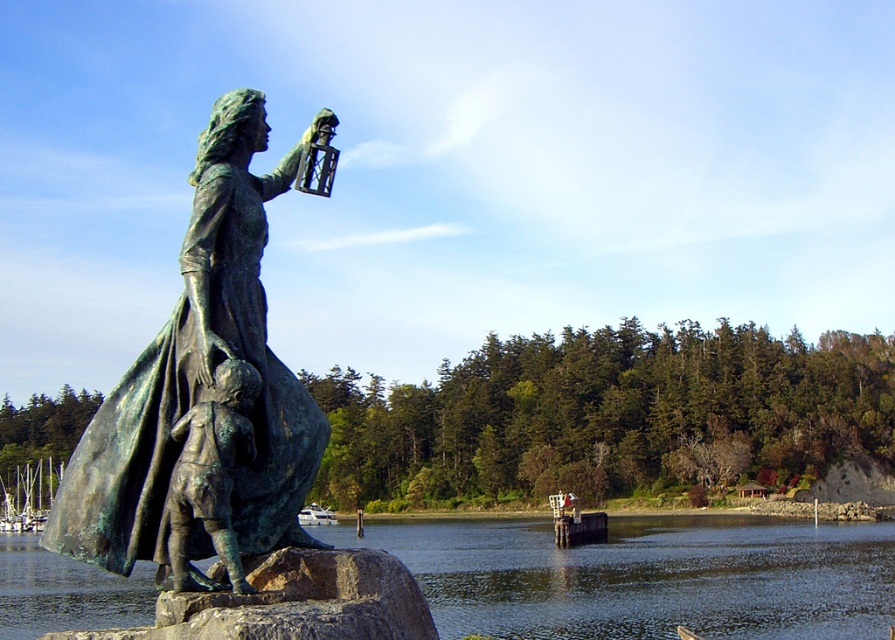
You are an artist planning to paint the scene. You need to decide which area to focus on first based on size. Which object should you start with, the greenish reflective water at lower center or the brushed metal boats at left?

The greenish reflective water at lower center is bigger than the brushed metal boats at left, so you should start with the greenish reflective water at lower center.

You are a tour guide leading a group to the green patina statue at center and the bronze statue child at lower left. The group asks if they can take a photo of both statues together in one frame. Based on their distance, would you say the statues are close enough to be captured in a single photo without moving the camera position?

The green patina statue at center and bronze statue child at lower left are 13.53 inches apart. Since this distance is relatively short, they can likely be captured in a single photo without needing to move the camera position, provided the camera has a wide enough lens or the photographer positions themselves appropriately to include both in the frame.